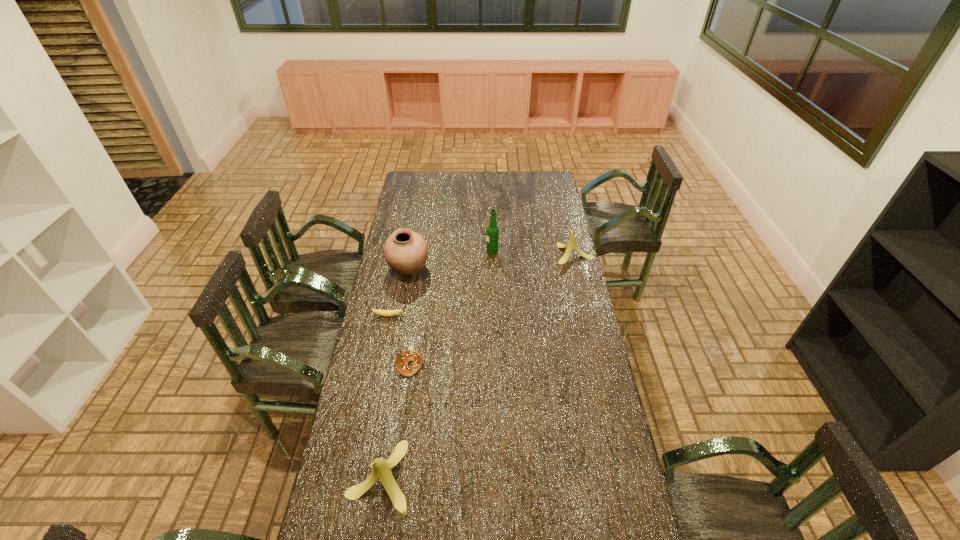
At what (x,y) coordinates should I click in order to perform the action: click on unoccupied area between the bagel and the pottery. Please return your answer as a coordinate pair (x, y). Looking at the image, I should click on (409, 316).

Locate an element on the screen. This screenshot has height=540, width=960. blank region between the farthest banana and the nearest banana is located at coordinates (477, 365).

Where is `empty space that is in between the shortest banana and the beer bottle`? This screenshot has width=960, height=540. empty space that is in between the shortest banana and the beer bottle is located at coordinates (441, 284).

Where is `empty space that is in between the shortest banana and the rightmost object`? empty space that is in between the shortest banana and the rightmost object is located at coordinates tap(481, 285).

Identify the location of free space that is in between the fifth tallest object and the fourth shortest object. tap(384, 396).

Where is `vacant space in between the nearest banana and the beer bottle`? vacant space in between the nearest banana and the beer bottle is located at coordinates (436, 364).

Point out which object is positioned as the nearest to the farthest banana. Please provide its 2D coordinates. Your answer should be formatted as a tuple, i.e. [(x, y)], where the tuple contains the x and y coordinates of a point satisfying the conditions above.

[(492, 230)]

This screenshot has width=960, height=540. Find the location of `object that is the fourth closest to the second farthest banana`. object that is the fourth closest to the second farthest banana is located at coordinates (381, 470).

Point out which banana is positioned as the nearest to the fourth shortest object. Please provide its 2D coordinates. Your answer should be formatted as a tuple, i.e. [(x, y)], where the tuple contains the x and y coordinates of a point satisfying the conditions above.

[(386, 313)]

This screenshot has width=960, height=540. Identify the location of banana identified as the third closest to the pottery. (381, 470).